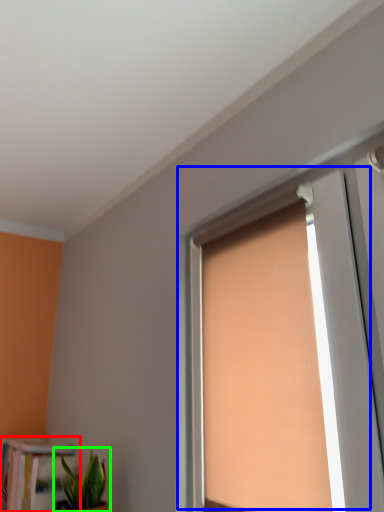
Question: Estimate the real-world distances between objects in this image. Which object is farther from bookcase (highlighted by a red box), window (highlighted by a blue box) or houseplant (highlighted by a green box)?

Choices:
 (A) window
 (B) houseplant

Answer: (A)